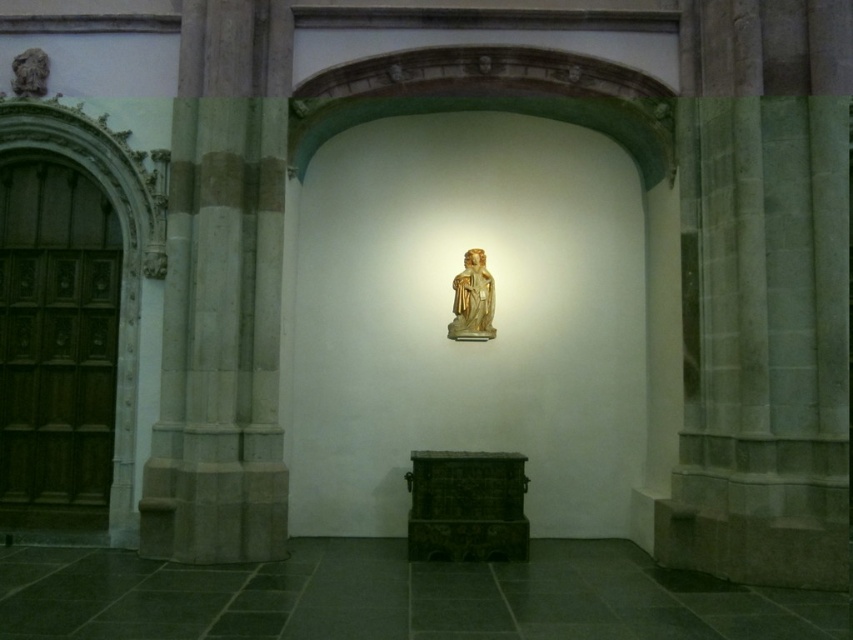
Does smooth stone pillar at left appear on the right side of gold polished wood statue at center?

No, smooth stone pillar at left is not to the right of gold polished wood statue at center.

Does point (160, 484) come farther from viewer compared to point (451, 332)?

No, it is in front of (451, 332).

Locate an element on the screen. The image size is (853, 640). smooth stone pillar at left is located at coordinates (222, 298).